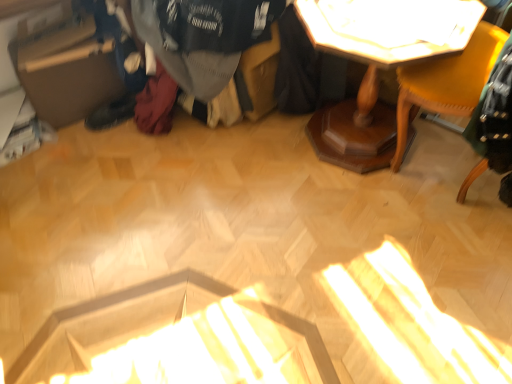
Question: Is wooden table at upper right next to matte yellow chair at upper right and touching it?

Choices:
 (A) yes
 (B) no

Answer: (B)

Question: From the image's perspective, is wooden table at upper right above matte yellow chair at upper right?

Choices:
 (A) yes
 (B) no

Answer: (A)

Question: Considering the relative sizes of wooden table at upper right and matte yellow chair at upper right in the image provided, is wooden table at upper right wider than matte yellow chair at upper right?

Choices:
 (A) no
 (B) yes

Answer: (B)

Question: Is wooden table at upper right closer to the viewer compared to matte yellow chair at upper right?

Choices:
 (A) no
 (B) yes

Answer: (A)

Question: From a real-world perspective, is wooden table at upper right over matte yellow chair at upper right?

Choices:
 (A) no
 (B) yes

Answer: (A)

Question: Does wooden table at upper right have a lesser width compared to matte yellow chair at upper right?

Choices:
 (A) yes
 (B) no

Answer: (B)

Question: Is brown cardboard box at left at the back of dark gray sweater at center?

Choices:
 (A) no
 (B) yes

Answer: (A)

Question: From the image's perspective, is dark gray sweater at center on top of brown cardboard box at left?

Choices:
 (A) yes
 (B) no

Answer: (A)

Question: Is dark gray sweater at center next to brown cardboard box at left?

Choices:
 (A) yes
 (B) no

Answer: (B)

Question: Does dark gray sweater at center contain brown cardboard box at left?

Choices:
 (A) no
 (B) yes

Answer: (A)

Question: Does dark gray sweater at center come in front of brown cardboard box at left?

Choices:
 (A) no
 (B) yes

Answer: (B)

Question: Is dark gray sweater at center aimed at brown cardboard box at left?

Choices:
 (A) no
 (B) yes

Answer: (A)

Question: Is matte yellow chair at upper right shorter than dark gray sweater at center?

Choices:
 (A) no
 (B) yes

Answer: (A)